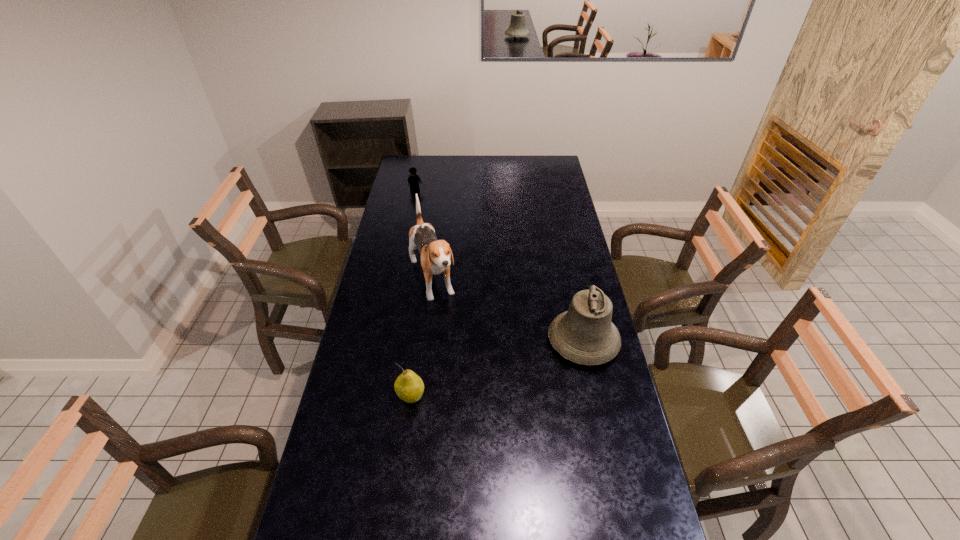
Find the location of a particular element. This screenshot has height=540, width=960. vacant space at the right edge of the desktop is located at coordinates (564, 187).

The width and height of the screenshot is (960, 540). I want to click on blank area at the near left corner, so click(x=324, y=508).

Find the location of a particular element. Image resolution: width=960 pixels, height=540 pixels. free space between the third farthest object and the farthest object is located at coordinates (499, 266).

Locate an element on the screen. vacant area that lies between the bell and the nearest object is located at coordinates (497, 369).

The image size is (960, 540). What are the coordinates of `free spot between the rightmost object and the third nearest object` in the screenshot? It's located at (507, 311).

Find the location of a particular element. This screenshot has height=540, width=960. blank region between the nearest object and the Lego is located at coordinates (414, 294).

Where is `blank region between the nearest object and the bell`? The image size is (960, 540). blank region between the nearest object and the bell is located at coordinates (497, 369).

Where is `blank region between the puppy and the pear`? blank region between the puppy and the pear is located at coordinates (421, 339).

This screenshot has width=960, height=540. In order to click on vacant area that lies between the nearest object and the second tallest object in this screenshot , I will do `click(497, 369)`.

Identify the location of free space between the nearest object and the third nearest object. The height and width of the screenshot is (540, 960). (421, 339).